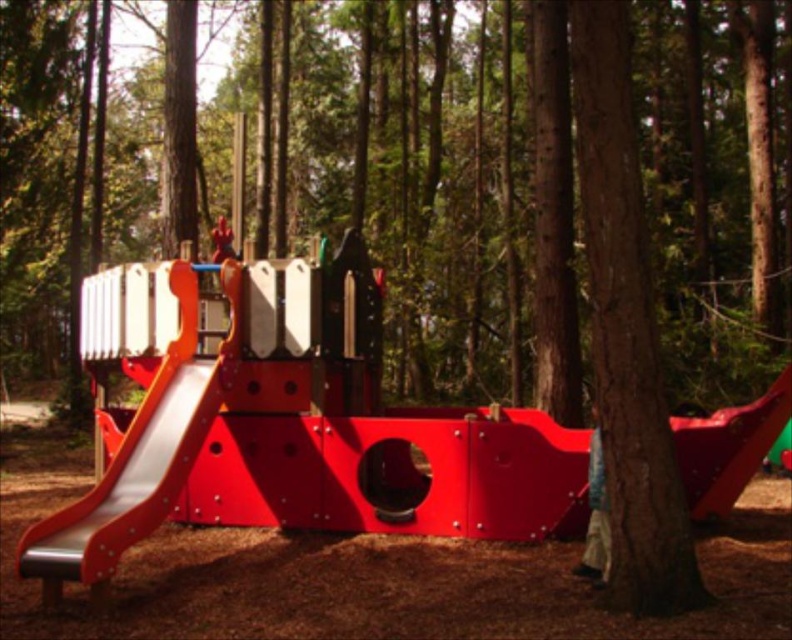
You are a parent supervising children at the playground. You see a metallic smooth slide at left and a red plastic child at center. Which object is closer to the right side of the playground?

The metallic smooth slide at left is to the right of red plastic child at center, so the metallic smooth slide at left is closer to the right side of the playground.

You are standing at the entrance of the playground and want to reach the slide on the left side of the play unit. The slide is located at point (155, 499). If you walk directly towards it, how far will you have to walk in feet?

The distance between your current position and the slide at point (155, 499) is 18.16 feet, so you will have to walk 18.16 feet to reach it.

You are a parent at the playground and want to ensure your child stays within your sight. You are standing near the red slide on the left side. Which object, the denim pants at lower right or the red plastic child at center, is closer to you?

The red plastic child at center is closer to you because the denim pants at lower right is not as tall as it, indicating it is farther away.